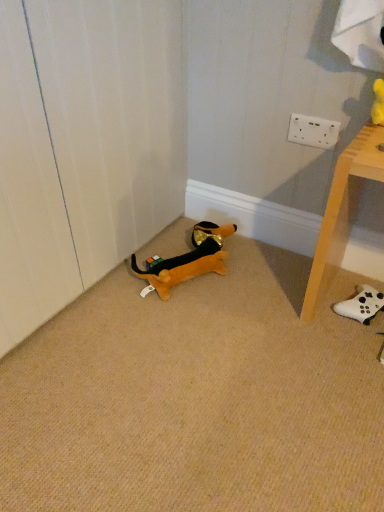
What do you see at coordinates (188, 260) in the screenshot?
I see `soft plush dog at lower left, the 1th toy in the left-to-right sequence` at bounding box center [188, 260].

What is the approximate height of white wood table at lower right?

white wood table at lower right is 20.04 inches in height.

Where is `white matte controller at lower right, which appears as the 1th toy when viewed from the right`? The width and height of the screenshot is (384, 512). white matte controller at lower right, which appears as the 1th toy when viewed from the right is located at coordinates (361, 304).

Which is more to the right, white matte controller at lower right, the 2th toy viewed from the left, or soft plush dog at lower left, the 1th toy in the left-to-right sequence?

From the viewer's perspective, white matte controller at lower right, the 2th toy viewed from the left, appears more on the right side.

From the image's perspective, is white matte controller at lower right, the 2th toy viewed from the left, above or below soft plush dog at lower left, the 1th toy in the left-to-right sequence?

From the image's perspective, white matte controller at lower right, the 2th toy viewed from the left, appears below soft plush dog at lower left, the 1th toy in the left-to-right sequence.

Is white matte controller at lower right, the 2th toy viewed from the left, directly adjacent to soft plush dog at lower left, the 1th toy in the left-to-right sequence?

No, white matte controller at lower right, the 2th toy viewed from the left, is not next to soft plush dog at lower left, the 1th toy in the left-to-right sequence.

Who is smaller, white matte controller at lower right, which appears as the 1th toy when viewed from the right, or soft plush dog at lower left, which is the second toy from right to left?

With smaller size is white matte controller at lower right, which appears as the 1th toy when viewed from the right.

Considering the relative sizes of soft plush dog at lower left, the 1th toy in the left-to-right sequence, and white matte controller at lower right, the 2th toy viewed from the left, in the image provided, is soft plush dog at lower left, the 1th toy in the left-to-right sequence, bigger than white matte controller at lower right, the 2th toy viewed from the left,?

Yes, soft plush dog at lower left, the 1th toy in the left-to-right sequence, is bigger than white matte controller at lower right, the 2th toy viewed from the left.

Is soft plush dog at lower left, the 1th toy in the left-to-right sequence, facing away from white matte controller at lower right, which appears as the 1th toy when viewed from the right?

soft plush dog at lower left, the 1th toy in the left-to-right sequence, is not turned away from white matte controller at lower right, which appears as the 1th toy when viewed from the right.

Where is `toy in front of the soft plush dog at lower left, which is the second toy from right to left`? The width and height of the screenshot is (384, 512). toy in front of the soft plush dog at lower left, which is the second toy from right to left is located at coordinates (361, 304).

Would you say soft plush dog at lower left, which is the second toy from right to left, is outside white matte controller at lower right, the 2th toy viewed from the left?

That's correct, soft plush dog at lower left, which is the second toy from right to left, is outside of white matte controller at lower right, the 2th toy viewed from the left.

Does white wood table at lower right come behind white matte controller at lower right, which appears as the 1th toy when viewed from the right?

No, it is in front of white matte controller at lower right, which appears as the 1th toy when viewed from the right.

You are a GUI agent. You are given a task and a screenshot of the screen. Output one action in this format:
    pyautogui.click(x=<x>, y=<y>)
    Task: Click on the furniture above the white matte controller at lower right, the 2th toy viewed from the left (from a real-world perspective)
    
    Given the screenshot: What is the action you would take?
    pyautogui.click(x=343, y=209)

From a real-world perspective, who is located higher, white wood table at lower right or white matte controller at lower right, which appears as the 1th toy when viewed from the right?

white wood table at lower right.

At what (x,y) coordinates should I click in order to perform the action: click on furniture above the soft plush dog at lower left, the 1th toy in the left-to-right sequence (from the image's perspective). Please return your answer as a coordinate pair (x, y). The height and width of the screenshot is (512, 384). Looking at the image, I should click on (343, 209).

Is soft plush dog at lower left, which is the second toy from right to left, completely or partially outside of white wood table at lower right?

Yes.

Does soft plush dog at lower left, which is the second toy from right to left, come behind white wood table at lower right?

That is True.

Is soft plush dog at lower left, which is the second toy from right to left, bigger than white wood table at lower right?

No, soft plush dog at lower left, which is the second toy from right to left, is not bigger than white wood table at lower right.

In terms of height, does white matte controller at lower right, which appears as the 1th toy when viewed from the right, look taller or shorter compared to white wood table at lower right?

Considering their sizes, white matte controller at lower right, which appears as the 1th toy when viewed from the right, has less height than white wood table at lower right.

Could you tell me if white matte controller at lower right, the 2th toy viewed from the left, is facing white wood table at lower right?

Yes, white matte controller at lower right, the 2th toy viewed from the left, is oriented towards white wood table at lower right.

Is white matte controller at lower right, the 2th toy viewed from the left, bigger than white wood table at lower right?

No.

Considering the sizes of white matte controller at lower right, which appears as the 1th toy when viewed from the right, and white wood table at lower right in the image, is white matte controller at lower right, which appears as the 1th toy when viewed from the right, wider or thinner than white wood table at lower right?

Clearly, white matte controller at lower right, which appears as the 1th toy when viewed from the right, has less width compared to white wood table at lower right.

From the picture: Is white wood table at lower right closer to camera compared to soft plush dog at lower left, which is the second toy from right to left?

Yes, white wood table at lower right is in front of soft plush dog at lower left, which is the second toy from right to left.

What are the coordinates of `the 1st toy directly beneath the white wood table at lower right (from a real-world perspective)` in the screenshot? It's located at (188, 260).

At what (x,y) coordinates should I click in order to perform the action: click on toy on the right side of soft plush dog at lower left, the 1th toy in the left-to-right sequence. Please return your answer as a coordinate pair (x, y). This screenshot has height=512, width=384. Looking at the image, I should click on (361, 304).

This screenshot has width=384, height=512. I want to click on toy in front of the soft plush dog at lower left, which is the second toy from right to left, so click(361, 304).

Which object lies further to the anchor point soft plush dog at lower left, which is the second toy from right to left, white matte controller at lower right, which appears as the 1th toy when viewed from the right, or white wood table at lower right?

white matte controller at lower right, which appears as the 1th toy when viewed from the right, is positioned further to the anchor soft plush dog at lower left, which is the second toy from right to left.

Looking at this image, when comparing their distances from white wood table at lower right, does soft plush dog at lower left, which is the second toy from right to left, or white matte controller at lower right, the 2th toy viewed from the left, seem closer?

white matte controller at lower right, the 2th toy viewed from the left, lies closer to white wood table at lower right than the other object.

Looking at the image, which one is located further to soft plush dog at lower left, the 1th toy in the left-to-right sequence, white wood table at lower right or white matte controller at lower right, which appears as the 1th toy when viewed from the right?

Among the two, white matte controller at lower right, which appears as the 1th toy when viewed from the right, is located further to soft plush dog at lower left, the 1th toy in the left-to-right sequence.

When comparing their distances from white wood table at lower right, does white matte controller at lower right, which appears as the 1th toy when viewed from the right, or soft plush dog at lower left, the 1th toy in the left-to-right sequence, seem closer?

white matte controller at lower right, which appears as the 1th toy when viewed from the right.

Based on their spatial positions, is soft plush dog at lower left, which is the second toy from right to left, or white wood table at lower right closer to white matte controller at lower right, which appears as the 1th toy when viewed from the right?

Among the two, white wood table at lower right is located nearer to white matte controller at lower right, which appears as the 1th toy when viewed from the right.

Considering their positions, is white wood table at lower right positioned further to white matte controller at lower right, the 2th toy viewed from the left, than soft plush dog at lower left, which is the second toy from right to left?

The object further to white matte controller at lower right, the 2th toy viewed from the left, is soft plush dog at lower left, which is the second toy from right to left.

Identify the location of furniture situated between soft plush dog at lower left, which is the second toy from right to left, and white matte controller at lower right, the 2th toy viewed from the left, from left to right. Image resolution: width=384 pixels, height=512 pixels. (343, 209).